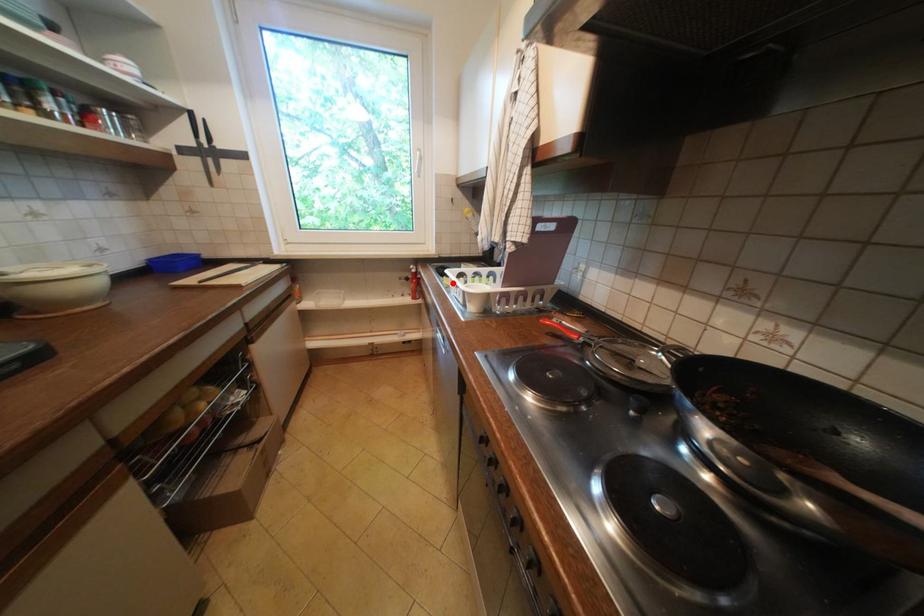
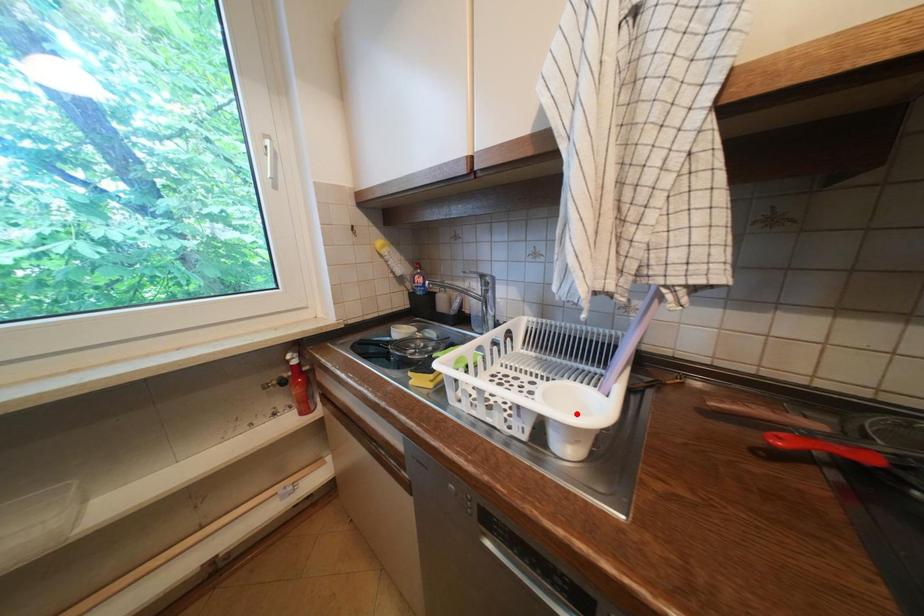
I am providing you with two images of the same scene from different viewpoints. A red point is marked on the first image and another point is marked on the second image. Are the points marked in image1 and image2 representing the same 3D position?

No